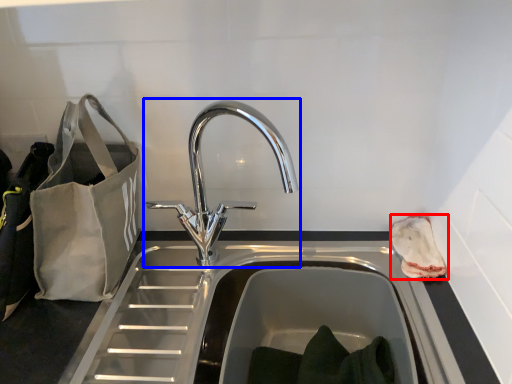
Question: Which object is closer to the camera taking this photo, pouch (highlighted by a red box) or tap (highlighted by a blue box)?

Choices:
 (A) pouch
 (B) tap

Answer: (B)